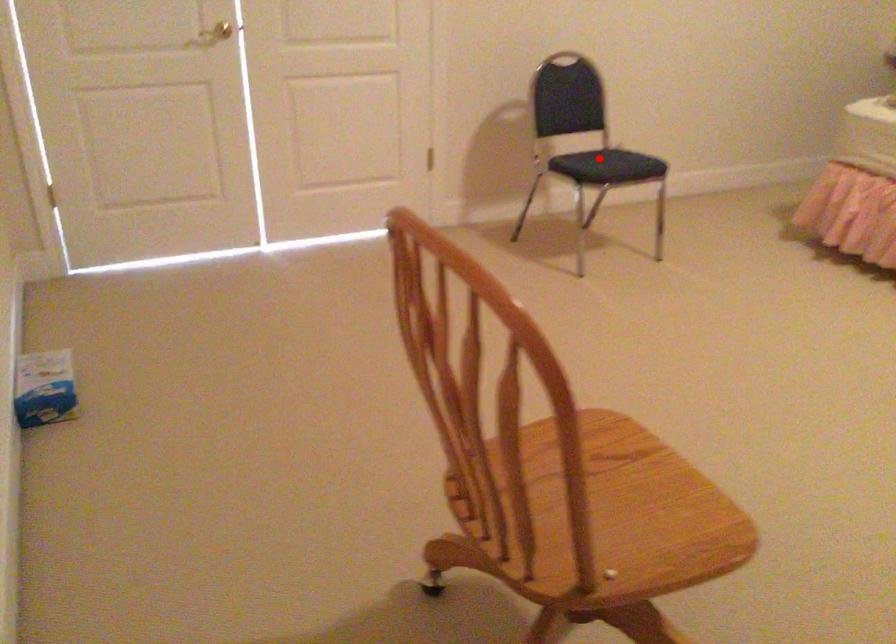
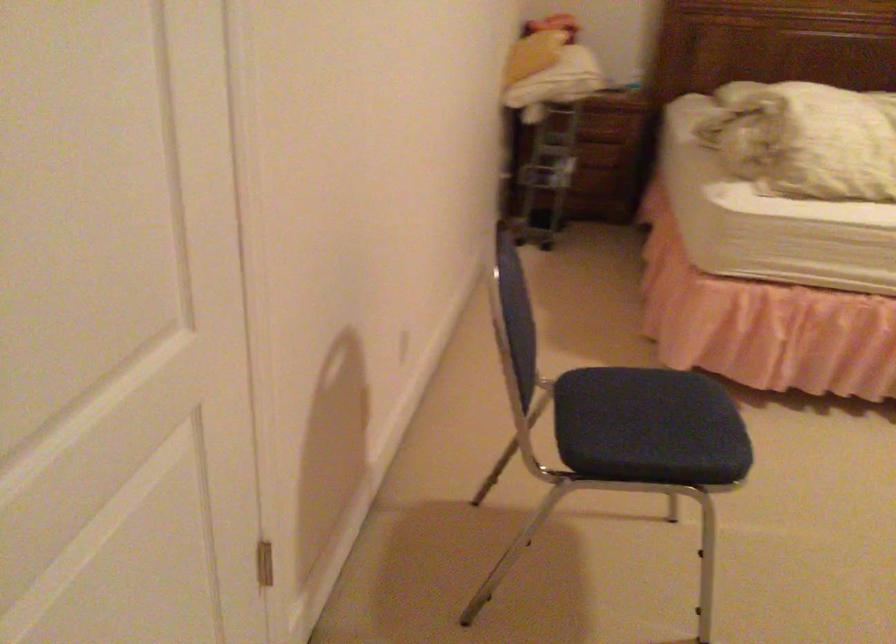
In the second image, find the point that corresponds to the highlighted location in the first image.

(650, 433)